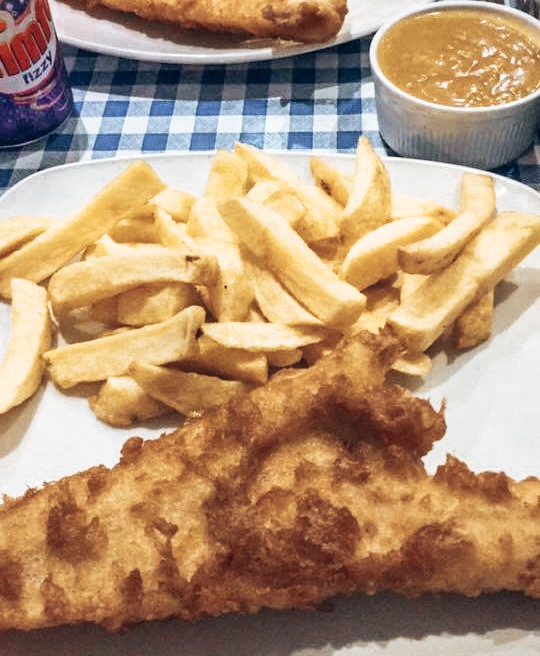
At what (x,y) coordinates should I click in order to perform the action: click on sauce bowl. Please return your answer as a coordinate pair (x, y). Looking at the image, I should click on (472, 130).